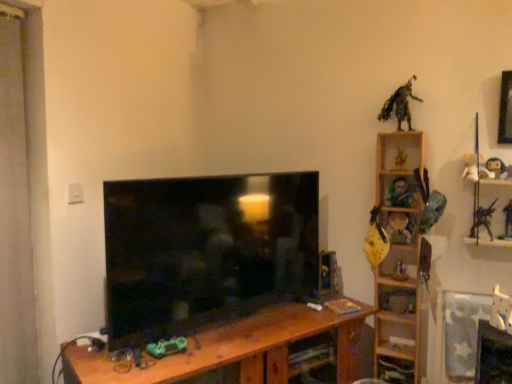
This screenshot has width=512, height=384. What are the coordinates of `free spot in front of green matte toy car at center, which is the 1th toy from left to right` in the screenshot? It's located at tap(159, 369).